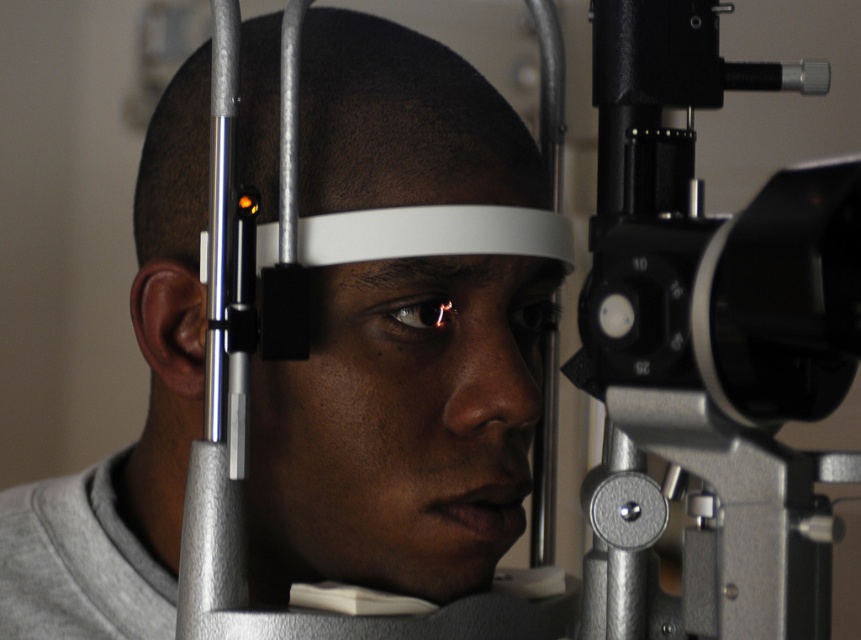
You are a technician operating an ophthalmic device. You need to adjust the distance between the silver metallic telescope at right and the matte black eye at center to 15 centimeters for a new patient. Is the current distance sufficient? Please explain.

The current distance between the silver metallic telescope at right and the matte black eye at center is 13.09 centimeters, which is less than the required 15 centimeters. Therefore, the technician needs to increase the distance by approximately 1.91 centimeters to meet the new requirement.

You are a technician adjusting the silver metallic telescope at right for an eye exam. The patient has a shiny black eye at center. To ensure proper alignment, you need to know if the telescope is positioned higher than the eye. Can you confirm this based on the image?

The silver metallic telescope at right is much taller than the shiny black eye at center, so yes, the telescope is positioned higher than the eye.

You are a technician adjusting the headband for an eye examination. The matte gray headband at center and the matte black eye at center are both part of the equipment. Which object is wider?

The matte gray headband at center is wider than the matte black eye at center.